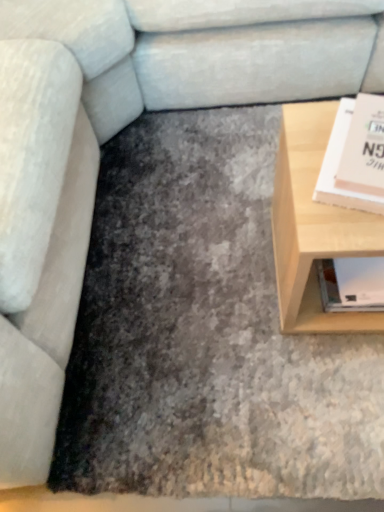
Question: Can you confirm if matte pink paperback book at right is shorter than light wood table at right?

Choices:
 (A) yes
 (B) no

Answer: (A)

Question: Is matte pink paperback book at right positioned behind light wood table at right?

Choices:
 (A) yes
 (B) no

Answer: (B)

Question: From the image's perspective, does matte pink paperback book at right appear lower than light wood table at right?

Choices:
 (A) no
 (B) yes

Answer: (A)

Question: Can you confirm if matte pink paperback book at right is wider than light wood table at right?

Choices:
 (A) no
 (B) yes

Answer: (A)

Question: Is matte pink paperback book at right oriented towards light wood table at right?

Choices:
 (A) yes
 (B) no

Answer: (B)

Question: Is matte pink paperback book at right at the right side of light wood table at right?

Choices:
 (A) yes
 (B) no

Answer: (A)

Question: Is light wood table at right touching matte pink paperback book at right?

Choices:
 (A) no
 (B) yes

Answer: (A)

Question: Is light wood table at right wider than matte pink paperback book at right?

Choices:
 (A) no
 (B) yes

Answer: (B)

Question: Does light wood table at right have a greater height compared to matte pink paperback book at right?

Choices:
 (A) yes
 (B) no

Answer: (A)

Question: Is light wood table at right to the left of matte pink paperback book at right from the viewer's perspective?

Choices:
 (A) no
 (B) yes

Answer: (B)

Question: Does light wood table at right come in front of matte pink paperback book at right?

Choices:
 (A) no
 (B) yes

Answer: (A)

Question: Is light wood table at right thinner than matte pink paperback book at right?

Choices:
 (A) yes
 (B) no

Answer: (B)

Question: From a real-world perspective, is light wood table at right physically located above or below matte pink paperback book at right?

Choices:
 (A) below
 (B) above

Answer: (A)